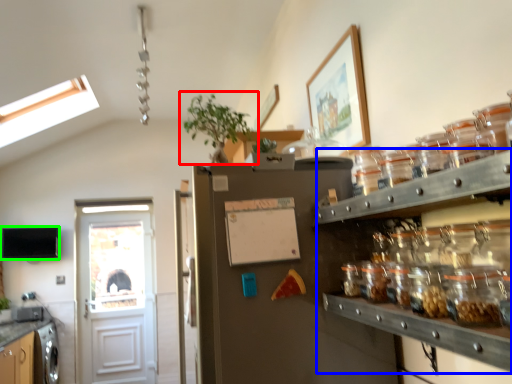
Question: Based on their relative distances, which object is farther from houseplant (highlighted by a red box)? Choose from shelf (highlighted by a blue box) and appliance (highlighted by a green box).

Choices:
 (A) shelf
 (B) appliance

Answer: (B)